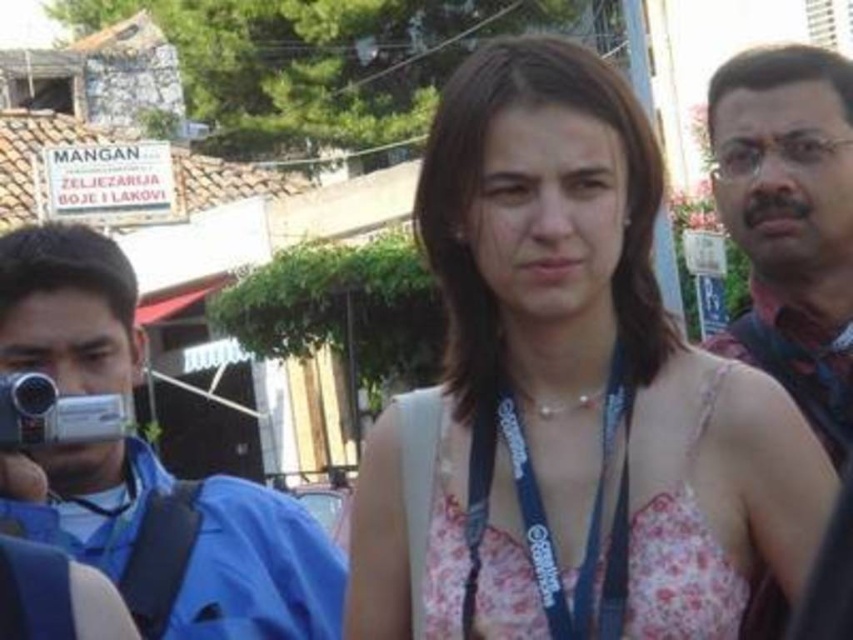
Does brown textured shirt at right appear over blue fabric lanyard at center?

Correct, brown textured shirt at right is located above blue fabric lanyard at center.

Identify the location of brown textured shirt at right. (790, 221).

Between blue fabric camera at left and silver metallic camera at left, which one appears on the right side from the viewer's perspective?

silver metallic camera at left is more to the right.

Looking at this image, is blue fabric camera at left above silver metallic camera at left?

Yes.

The width and height of the screenshot is (853, 640). Find the location of `blue fabric camera at left`. blue fabric camera at left is located at coordinates pos(178,541).

Identify the location of blue fabric camera at left. (178, 541).

Is blue fabric camera at left taller than blue fabric lanyard at center?

Correct, blue fabric camera at left is much taller as blue fabric lanyard at center.

Between blue fabric camera at left and blue fabric lanyard at center, which one has less height?

With less height is blue fabric lanyard at center.

Locate an element on the screen. blue fabric camera at left is located at coordinates (178, 541).